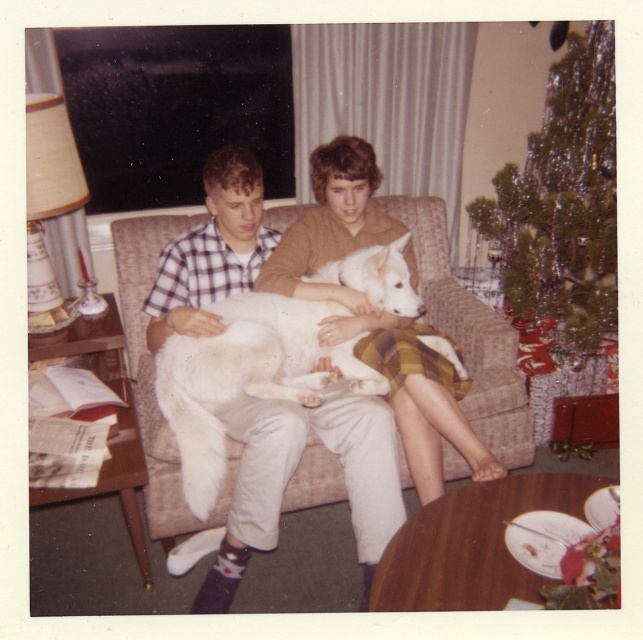
Question: Which object is the farthest from the white fluffy dog at center?

Choices:
 (A) beige fabric couch at center
 (B) green shiny christmas tree at upper right

Answer: (B)

Question: Does green shiny christmas tree at upper right have a larger size compared to white fluffy dog at center?

Choices:
 (A) yes
 (B) no

Answer: (A)

Question: Can you confirm if beige fabric couch at center is positioned to the left of white fluffy dog at center?

Choices:
 (A) yes
 (B) no

Answer: (B)

Question: Which point is closer to the camera?

Choices:
 (A) (280, 396)
 (B) (132, 342)
 (C) (530, 236)
 (D) (419, 468)

Answer: (A)

Question: Which point is farther to the camera?

Choices:
 (A) (168, 500)
 (B) (377, 353)
 (C) (367, 280)

Answer: (B)

Question: Can you confirm if beige fabric couch at center is wider than white fluffy dog at center?

Choices:
 (A) yes
 (B) no

Answer: (A)